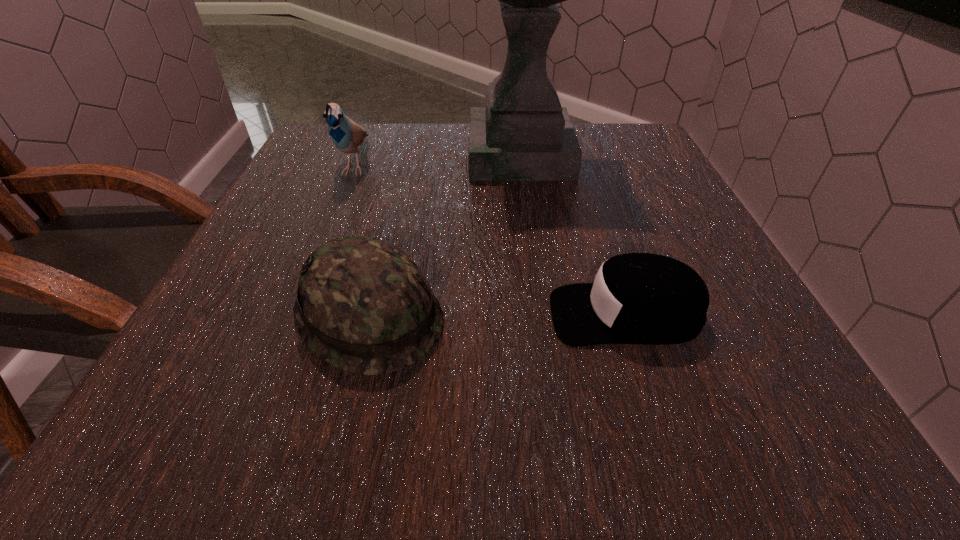
Where is `vacant region located on the left of the third tallest object`? vacant region located on the left of the third tallest object is located at coordinates (232, 315).

Identify the location of vacant area situated 0.120m on the front-facing side of the right cap. Image resolution: width=960 pixels, height=540 pixels. (468, 314).

Identify the location of free spot located on the front-facing side of the right cap. Image resolution: width=960 pixels, height=540 pixels. (332, 314).

Identify the location of free space located 0.350m on the front-facing side of the right cap. This screenshot has height=540, width=960. (312, 314).

Locate an element on the screen. sculpture that is positioned at the far edge is located at coordinates (522, 134).

Image resolution: width=960 pixels, height=540 pixels. What are the coordinates of `bird that is at the far edge` in the screenshot? It's located at (347, 135).

Where is `bird that is at the left edge`? This screenshot has width=960, height=540. bird that is at the left edge is located at coordinates (347, 135).

At what (x,y) coordinates should I click in order to perform the action: click on headwear located at the left edge. Please return your answer as a coordinate pair (x, y). This screenshot has height=540, width=960. Looking at the image, I should click on coord(364,306).

Where is `object located in the right edge section of the desktop`? This screenshot has height=540, width=960. object located in the right edge section of the desktop is located at coordinates (637, 298).

The height and width of the screenshot is (540, 960). I want to click on object positioned at the far left corner, so click(x=347, y=135).